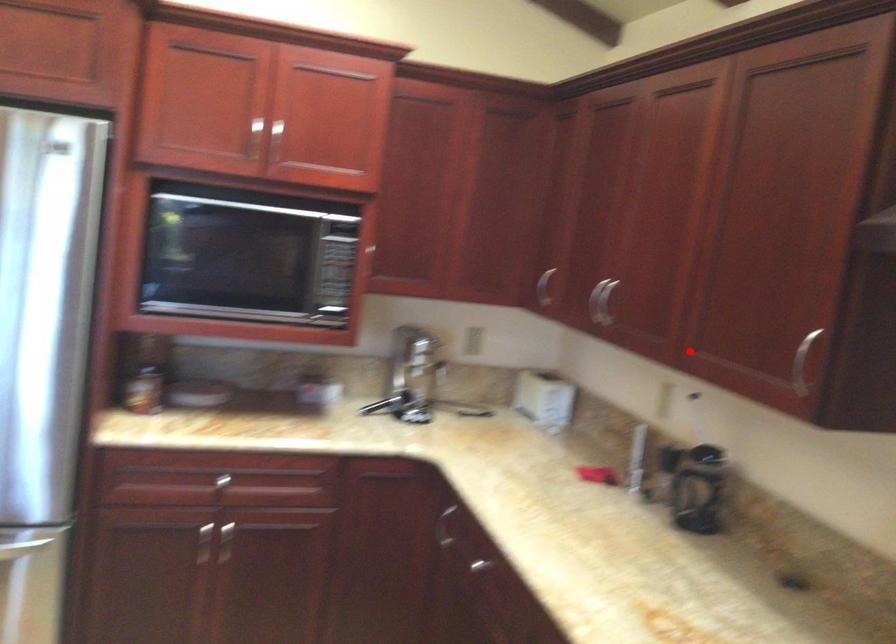
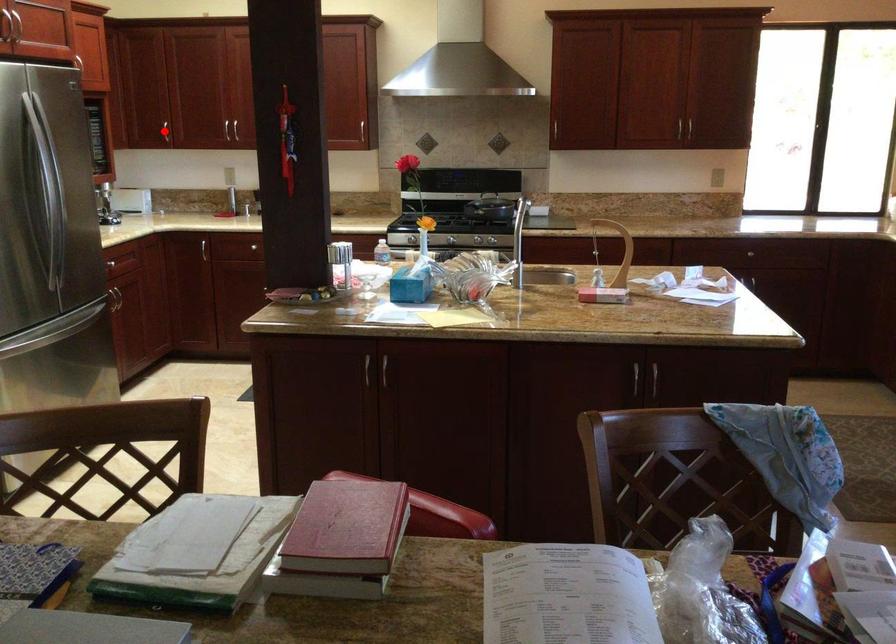
I am providing you with two images of the same scene from different viewpoints. A red point is marked on the first image and another point is marked on the second image. Is the marked point in image1 the same physical position as the marked point in image2?

No